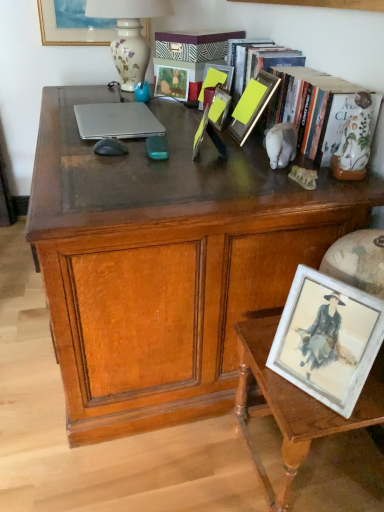
Locate an element on the screen. vacant space situated on the left part of wooden table at lower right is located at coordinates (189, 463).